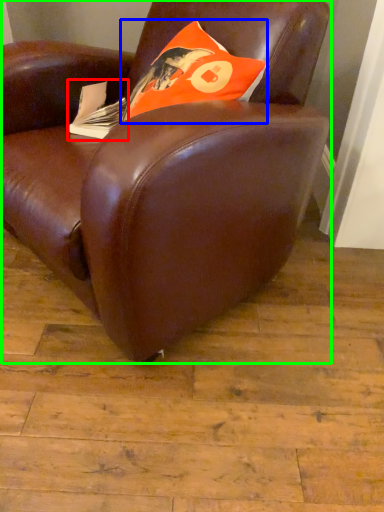
Question: Estimate the real-world distances between objects in this image. Which object is farther from paperback book (highlighted by a red box), throw pillow (highlighted by a blue box) or chair (highlighted by a green box)?

Choices:
 (A) throw pillow
 (B) chair

Answer: (B)